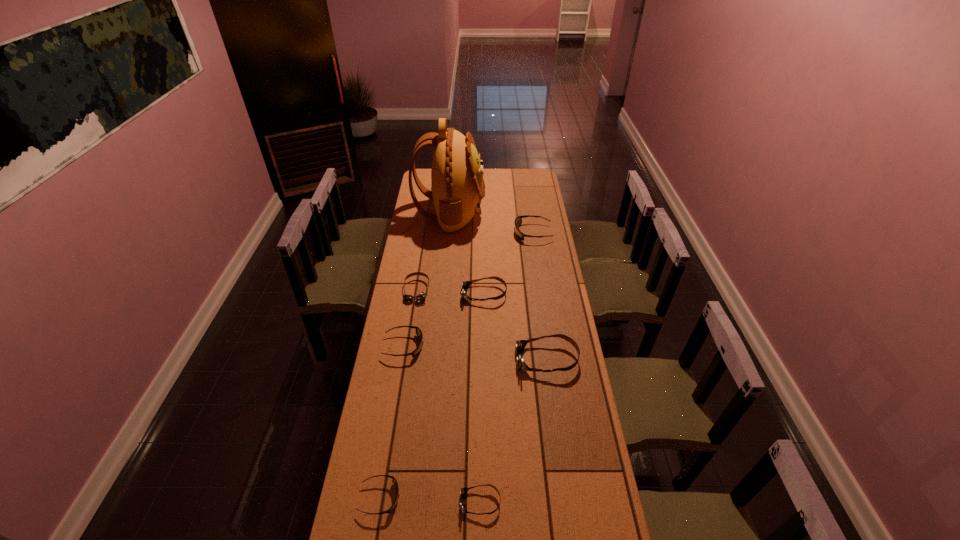
Locate an element on the screen. The width and height of the screenshot is (960, 540). vacant region at the right edge of the desktop is located at coordinates (x=544, y=213).

In order to click on free space that is in between the third smallest brown goggles and the second farthest black goggles in this screenshot , I will do `click(444, 320)`.

Locate an element on the screen. Image resolution: width=960 pixels, height=540 pixels. empty space between the smallest black goggles and the second biggest brown goggles is located at coordinates tap(432, 396).

Find the location of a particular element. vacant space that is in between the second nearest black goggles and the second biggest brown goggles is located at coordinates (444, 320).

The image size is (960, 540). I want to click on free space between the smallest black goggles and the second nearest black goggles, so click(x=392, y=422).

Image resolution: width=960 pixels, height=540 pixels. I want to click on vacant point located between the rightmost black goggles and the second biggest brown goggles, so click(509, 264).

Where is `free area in between the smallest black goggles and the second tallest object`? This screenshot has height=540, width=960. free area in between the smallest black goggles and the second tallest object is located at coordinates (464, 429).

This screenshot has width=960, height=540. Identify the location of free space between the biggest black goggles and the second biggest brown goggles. (509, 264).

The width and height of the screenshot is (960, 540). In order to click on vacant area that lies between the tallest object and the biggest black goggles in this screenshot , I will do `click(492, 222)`.

Image resolution: width=960 pixels, height=540 pixels. Identify the location of blank region between the rightmost brown goggles and the biggest black goggles. (540, 296).